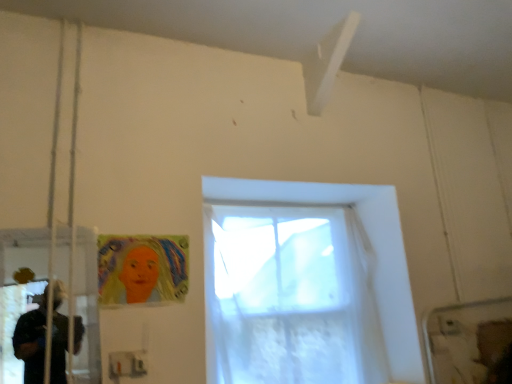
Question: Does transparent plastic screen door at left appear on the left side of translucent white curtain at center?

Choices:
 (A) no
 (B) yes

Answer: (B)

Question: Is transparent plastic screen door at left at the right side of translucent white curtain at center?

Choices:
 (A) yes
 (B) no

Answer: (B)

Question: From the image's perspective, is transparent plastic screen door at left over translucent white curtain at center?

Choices:
 (A) no
 (B) yes

Answer: (B)

Question: Considering the relative sizes of transparent plastic screen door at left and translucent white curtain at center in the image provided, is transparent plastic screen door at left wider than translucent white curtain at center?

Choices:
 (A) yes
 (B) no

Answer: (B)

Question: From the image's perspective, does transparent plastic screen door at left appear lower than translucent white curtain at center?

Choices:
 (A) yes
 (B) no

Answer: (B)

Question: Is the position of transparent plastic screen door at left less distant than that of translucent white curtain at center?

Choices:
 (A) yes
 (B) no

Answer: (A)

Question: Is the depth of pastel crayon drawing of a woman at lower left less than that of transparent plastic screen door at left?

Choices:
 (A) yes
 (B) no

Answer: (B)

Question: Considering the relative positions of pastel crayon drawing of a woman at lower left and transparent plastic screen door at left in the image provided, is pastel crayon drawing of a woman at lower left behind transparent plastic screen door at left?

Choices:
 (A) yes
 (B) no

Answer: (A)

Question: From a real-world perspective, is pastel crayon drawing of a woman at lower left positioned over transparent plastic screen door at left based on gravity?

Choices:
 (A) no
 (B) yes

Answer: (B)

Question: From the image's perspective, does pastel crayon drawing of a woman at lower left appear lower than transparent plastic screen door at left?

Choices:
 (A) yes
 (B) no

Answer: (B)

Question: Is pastel crayon drawing of a woman at lower left wider than transparent plastic screen door at left?

Choices:
 (A) yes
 (B) no

Answer: (B)

Question: From a real-world perspective, is pastel crayon drawing of a woman at lower left below transparent plastic screen door at left?

Choices:
 (A) yes
 (B) no

Answer: (B)

Question: Is pastel crayon drawing of a woman at lower left in front of translucent white curtain at center?

Choices:
 (A) yes
 (B) no

Answer: (A)